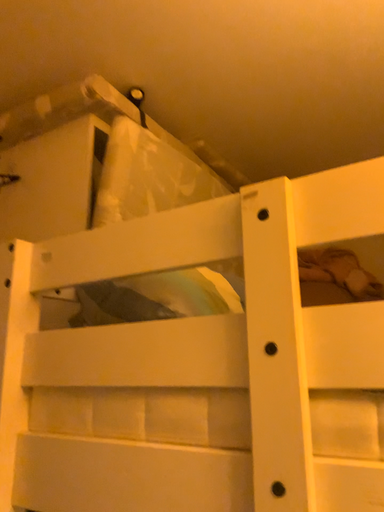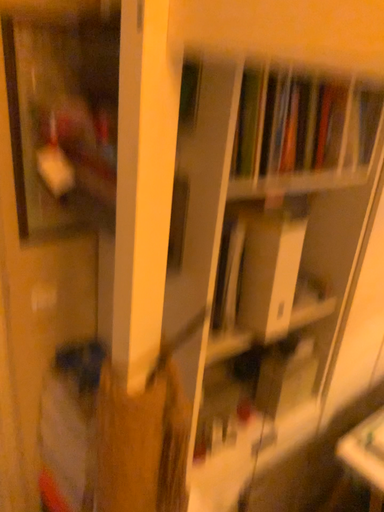
Question: How did the camera likely rotate when shooting the video?

Choices:
 (A) rotated upward
 (B) rotated downward

Answer: (B)